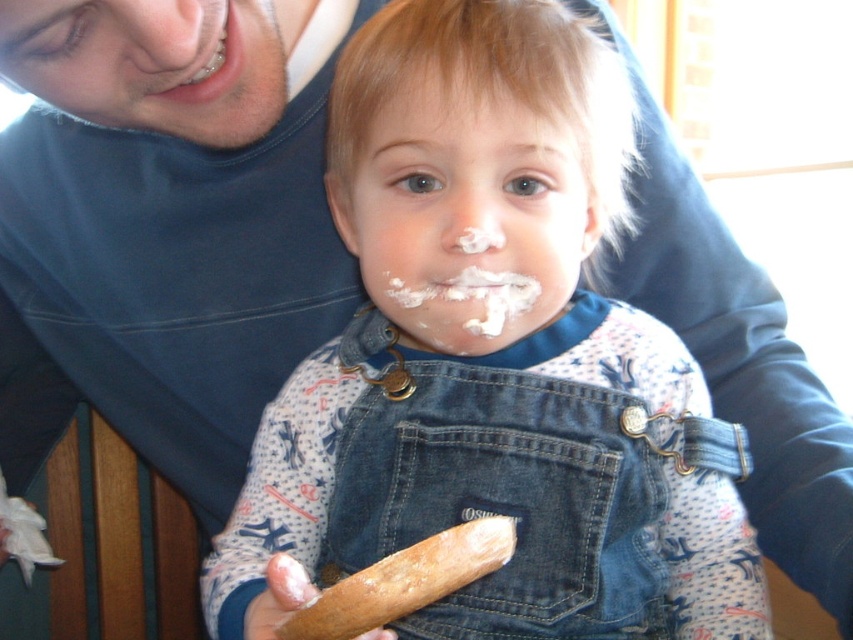
The child is wearing denim overalls at center and has white creamy icing at center on their face. Which item is wider?

The denim overalls at center is wider than the white creamy icing at center.

You are a photographer trying to capture a candid shot of the child in the denim overalls at center and the adult in the matte blue shirt at upper left. Based on their positions, which subject is closer to the camera?

The denim overalls at center is below matte blue shirt at upper left, meaning the matte blue shirt at upper left is closer to the camera since it is positioned higher in the frame.